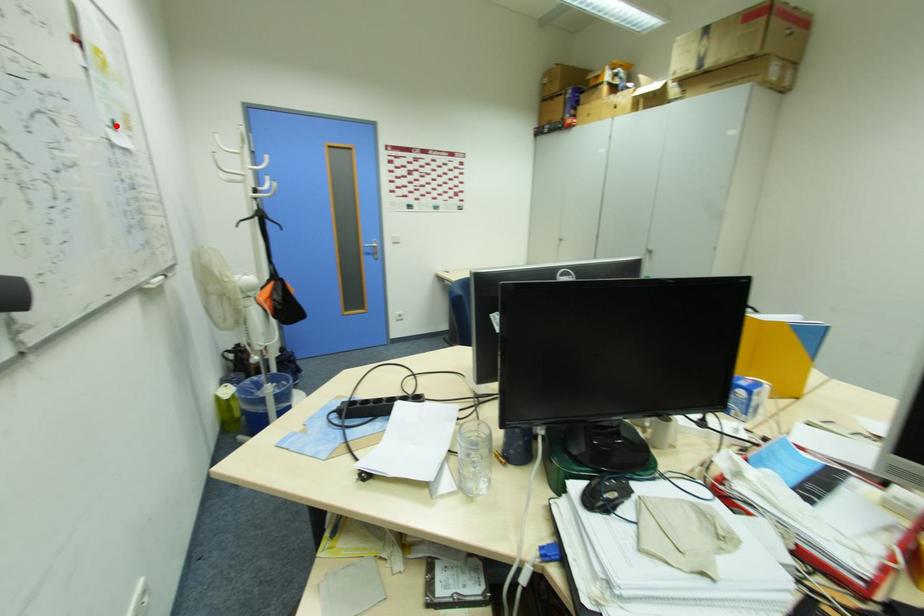
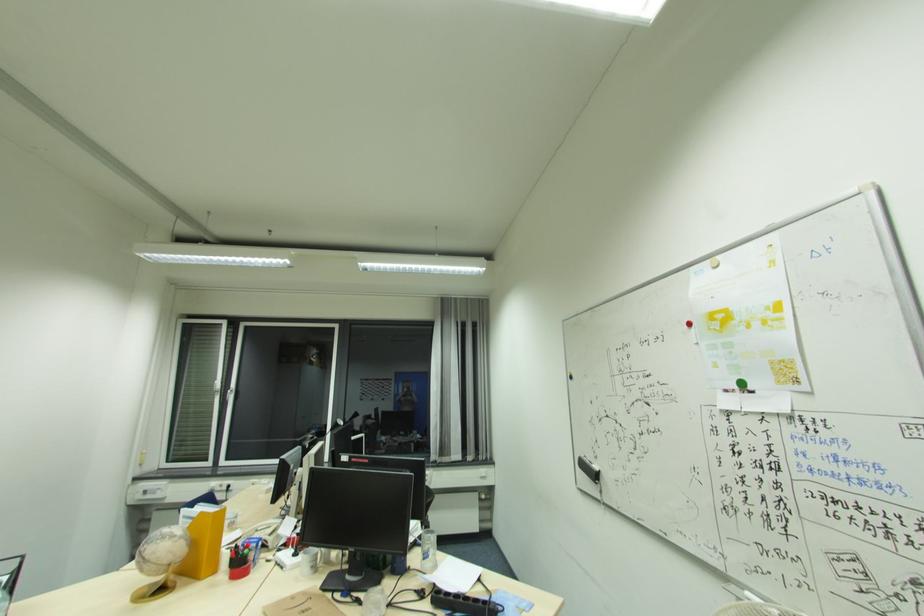
Question: I am providing you with two images of the same scene from different viewpoints. A red point is marked on the first image. Can you still see the location of the red point in image 2?

Choices:
 (A) Yes
 (B) No

Answer: (A)